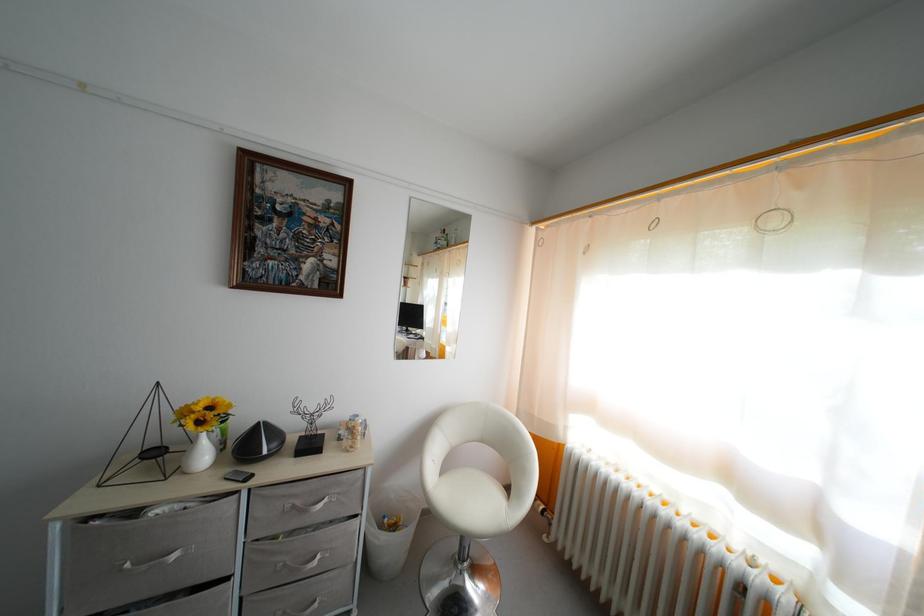
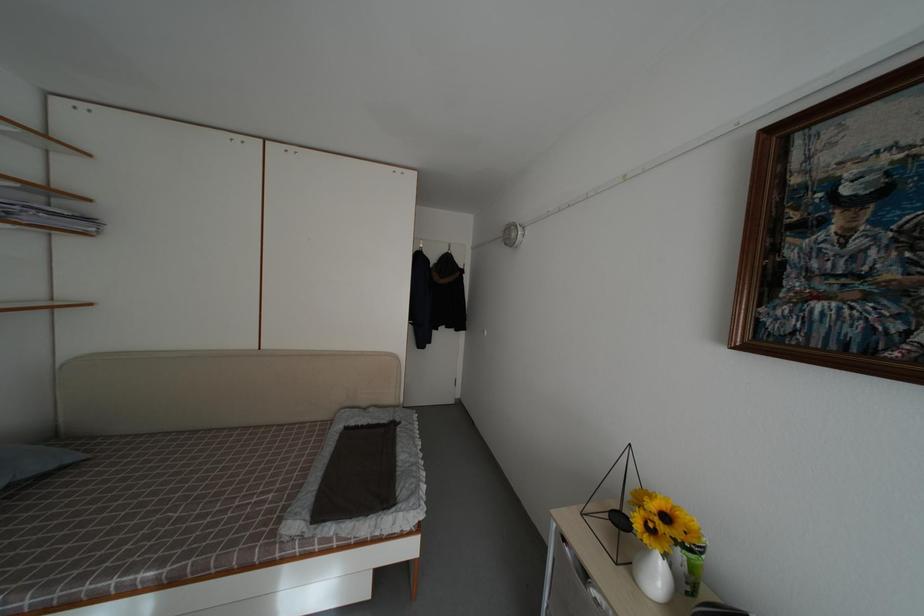
Question: Based on the continuous images, in which direction is the camera rotating? Reply with the corresponding letter.

Choices:
 (A) Left
 (B) Right
 (C) Up
 (D) Down

Answer: (A)